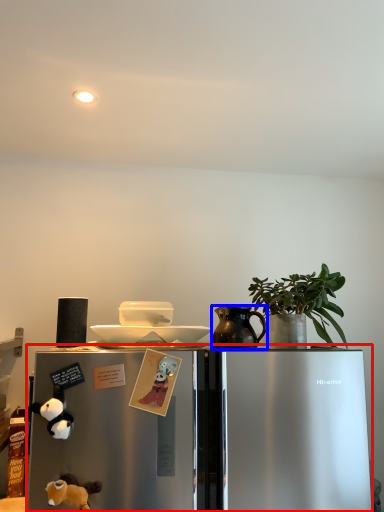
Question: Which point is closer to the camera, refrigerator (highlighted by a red box) or jug (highlighted by a blue box)?

Choices:
 (A) refrigerator
 (B) jug

Answer: (A)